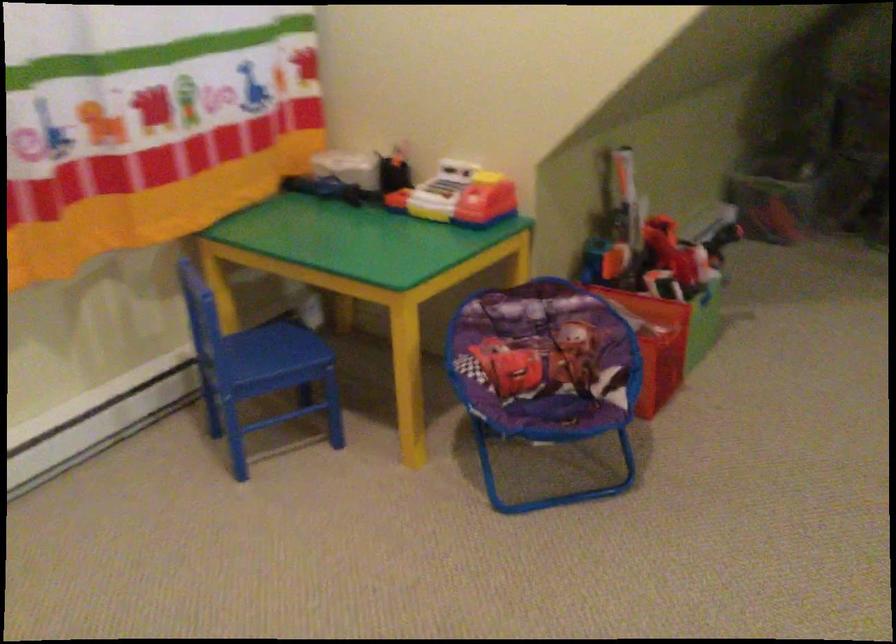
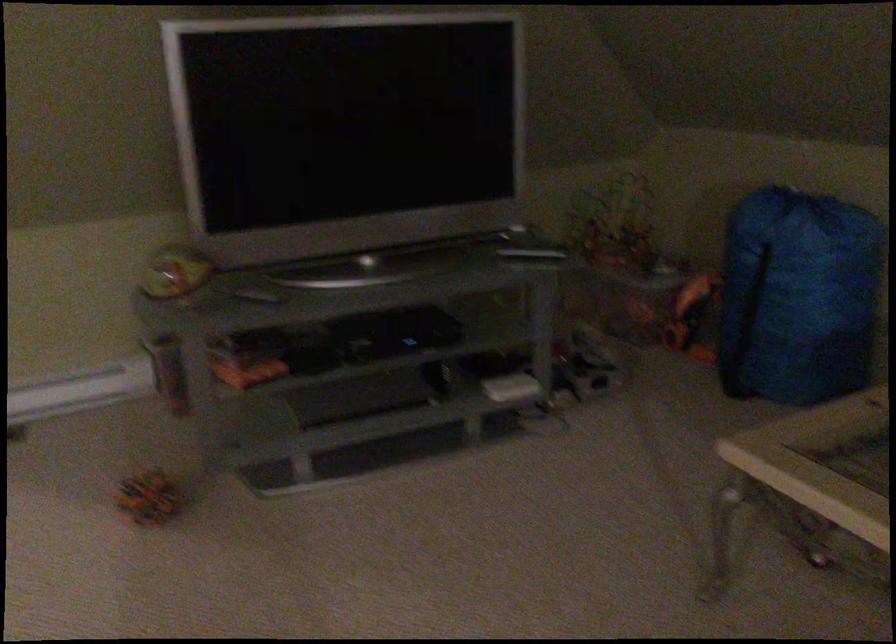
Question: In a continuous first-person perspective shot, in which direction is the camera moving?

Choices:
 (A) Left
 (B) Right
 (C) Forward
 (D) Backward

Answer: (B)